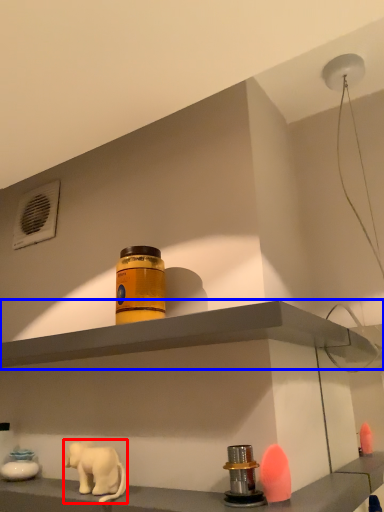
Question: Which object is further to the camera taking this photo, elephant (highlighted by a red box) or shelf (highlighted by a blue box)?

Choices:
 (A) elephant
 (B) shelf

Answer: (A)